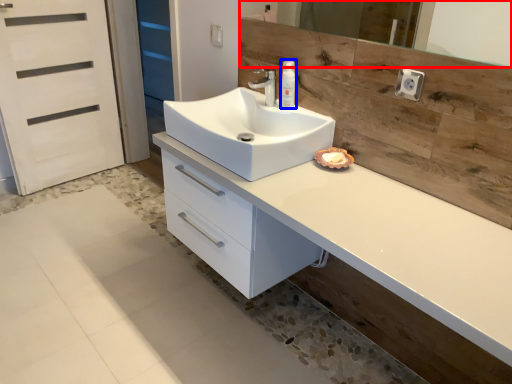
Question: Among these objects, which one is farthest to the camera, mirror (highlighted by a red box) or soap dispenser (highlighted by a blue box)?

Choices:
 (A) mirror
 (B) soap dispenser

Answer: (B)